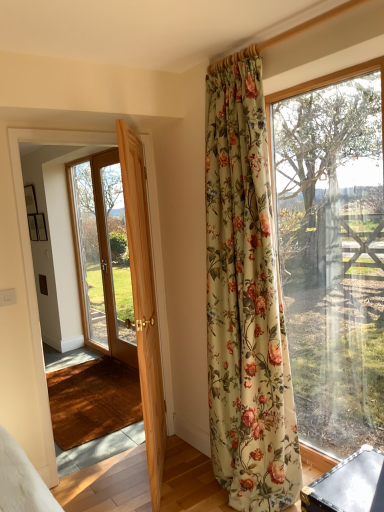
Question: Is transparent glass window at right facing towards floral fabric curtain at upper right?

Choices:
 (A) no
 (B) yes

Answer: (B)

Question: From the image's perspective, is transparent glass window at right beneath floral fabric curtain at upper right?

Choices:
 (A) yes
 (B) no

Answer: (A)

Question: Does transparent glass window at right have a greater height compared to floral fabric curtain at upper right?

Choices:
 (A) yes
 (B) no

Answer: (B)

Question: Does transparent glass window at right appear on the right side of floral fabric curtain at upper right?

Choices:
 (A) no
 (B) yes

Answer: (B)

Question: Are transparent glass window at right and floral fabric curtain at upper right beside each other?

Choices:
 (A) yes
 (B) no

Answer: (B)

Question: Is there a large distance between transparent glass window at right and floral fabric curtain at upper right?

Choices:
 (A) no
 (B) yes

Answer: (A)

Question: Can you confirm if transparent glass window at right is bigger than clear glass door at left?

Choices:
 (A) yes
 (B) no

Answer: (B)

Question: From the image's perspective, is transparent glass window at right located beneath clear glass door at left?

Choices:
 (A) no
 (B) yes

Answer: (B)

Question: Does transparent glass window at right have a greater width compared to clear glass door at left?

Choices:
 (A) no
 (B) yes

Answer: (A)

Question: Considering the relative sizes of transparent glass window at right and clear glass door at left in the image provided, is transparent glass window at right thinner than clear glass door at left?

Choices:
 (A) no
 (B) yes

Answer: (B)

Question: Can you confirm if transparent glass window at right is smaller than clear glass door at left?

Choices:
 (A) yes
 (B) no

Answer: (A)

Question: Are transparent glass window at right and clear glass door at left making contact?

Choices:
 (A) no
 (B) yes

Answer: (A)

Question: Considering the relative positions of floral fabric curtain at upper right and light wood door at left in the image provided, is floral fabric curtain at upper right to the left of light wood door at left from the viewer's perspective?

Choices:
 (A) no
 (B) yes

Answer: (A)